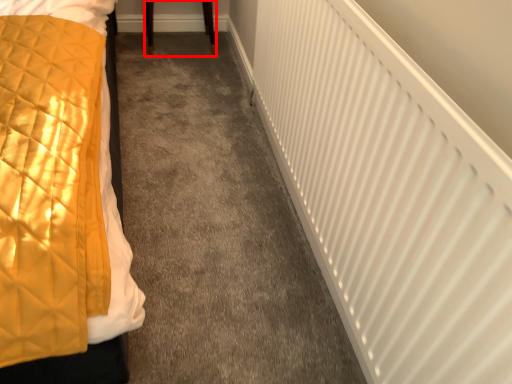
Question: In this image, where is furniture (annotated by the red box) located relative to radiator?

Choices:
 (A) left
 (B) right

Answer: (A)